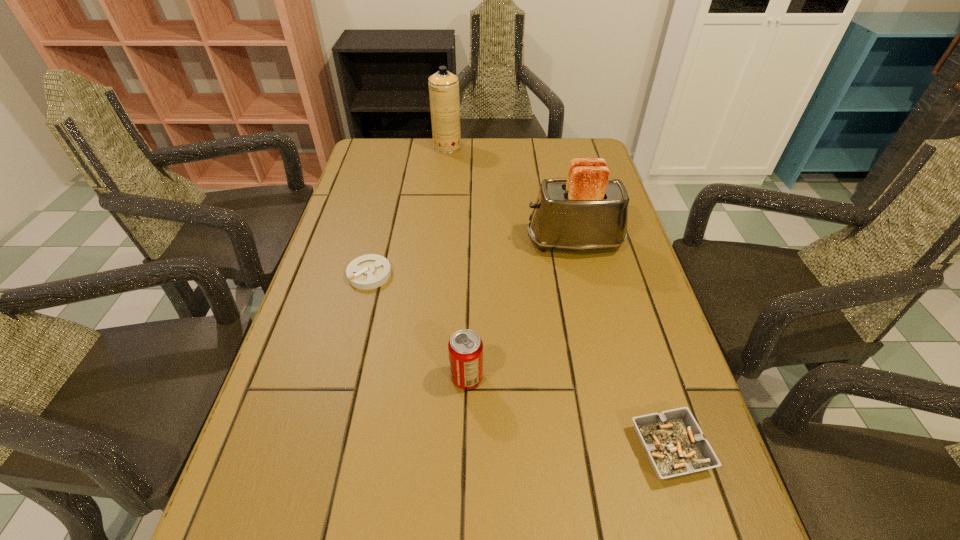
At what (x,y) coordinates should I click in order to perform the action: click on free spot between the farthest object and the left ashtray. Please return your answer as a coordinate pair (x, y). Image resolution: width=960 pixels, height=540 pixels. Looking at the image, I should click on (408, 211).

The width and height of the screenshot is (960, 540). Find the location of `vacant area between the second nearest object and the farther ashtray`. vacant area between the second nearest object and the farther ashtray is located at coordinates (419, 326).

In order to click on free space that is in between the toaster and the nearer ashtray in this screenshot , I will do `click(622, 346)`.

In order to click on free space between the aerosol can and the third shortest object in this screenshot , I will do `click(457, 262)`.

Select which object appears as the second closest to the farthest object. Please provide its 2D coordinates. Your answer should be formatted as a tuple, i.e. [(x, y)], where the tuple contains the x and y coordinates of a point satisfying the conditions above.

[(370, 271)]

At what (x,y) coordinates should I click in order to perform the action: click on the fourth closest object to the aerosol can. Please return your answer as a coordinate pair (x, y). This screenshot has width=960, height=540. Looking at the image, I should click on (673, 441).

The width and height of the screenshot is (960, 540). Find the location of `free space that satisfies the following two spatial constraints: 1. on the side of the toaster with the control lever; 2. on the left side of the right ashtray`. free space that satisfies the following two spatial constraints: 1. on the side of the toaster with the control lever; 2. on the left side of the right ashtray is located at coordinates (622, 449).

This screenshot has height=540, width=960. Find the location of `vacant space that satisfies the following two spatial constraints: 1. on the side of the toaster with the control lever; 2. on the front side of the third shortest object`. vacant space that satisfies the following two spatial constraints: 1. on the side of the toaster with the control lever; 2. on the front side of the third shortest object is located at coordinates (606, 377).

Locate an element on the screen. The height and width of the screenshot is (540, 960). vacant space that satisfies the following two spatial constraints: 1. on the back side of the second object from left to right; 2. on the right side of the shorter ashtray is located at coordinates click(x=401, y=147).

Where is `free space in the image that satisfies the following two spatial constraints: 1. on the back side of the nearer ashtray; 2. on the side of the toaster with the control lever`? free space in the image that satisfies the following two spatial constraints: 1. on the back side of the nearer ashtray; 2. on the side of the toaster with the control lever is located at coordinates (606, 242).